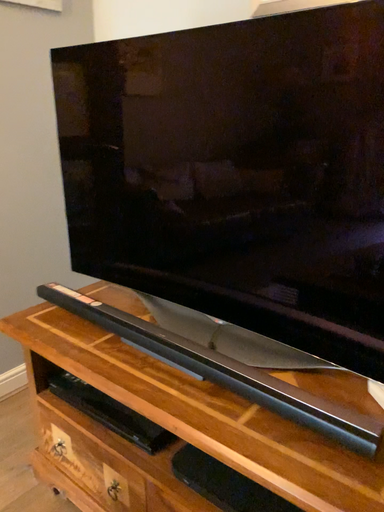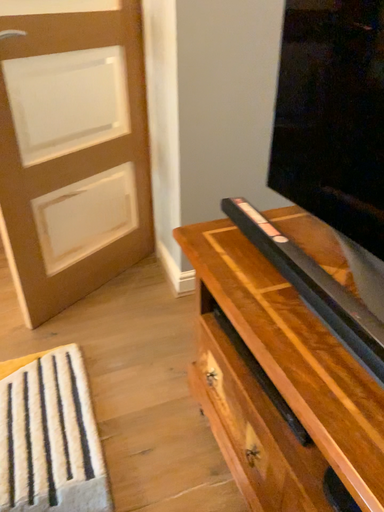
Question: Which way did the camera rotate in the video?

Choices:
 (A) rotated upward
 (B) rotated downward

Answer: (B)